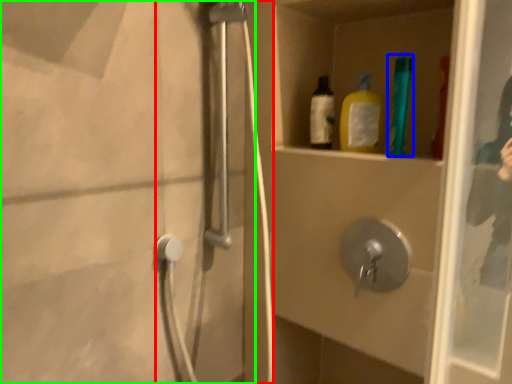
Question: Which is nearer to the shower door (highlighted by a red box)? bottle (highlighted by a blue box) or screen door (highlighted by a green box).

Choices:
 (A) bottle
 (B) screen door

Answer: (B)